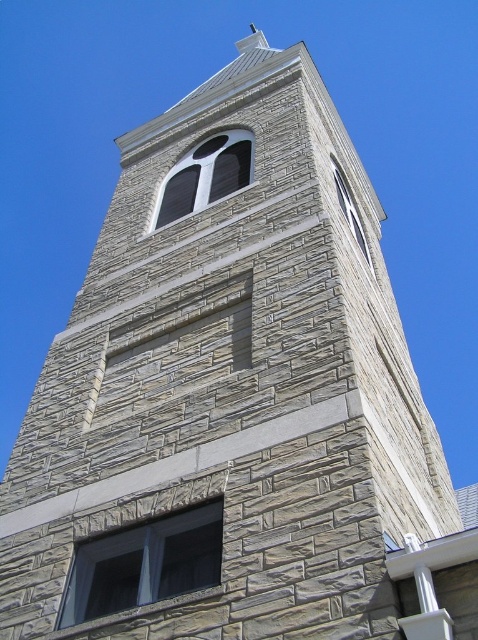
You are a window cleaner with a ladder that can reach up to 25 meters. You need to clean both the matte gray stone window at center and the smooth stone window at upper center. Can you clean both windows with your current ladder?

The matte gray stone window at center and smooth stone window at upper center are 27.36 meters apart from each other. Since your ladder can only reach up to 25 meters, you cannot clean both windows with your current ladder as the distance between them exceeds the ladder height limit.

You are an architect examining the tower. You notice the matte glass window at center and the smooth stone window at upper center. Which of these two windows is taller?

The smooth stone window at upper center is taller than the matte glass window at center.